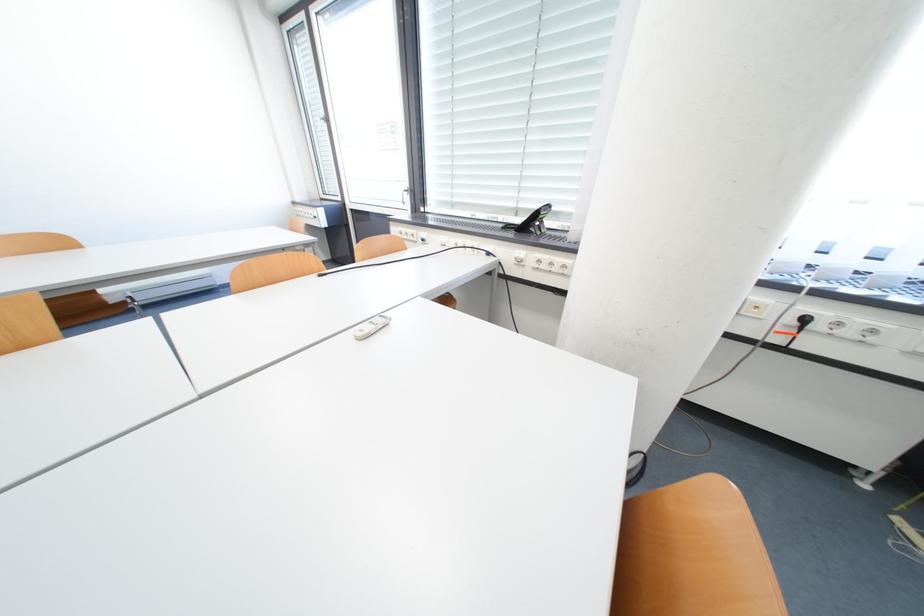
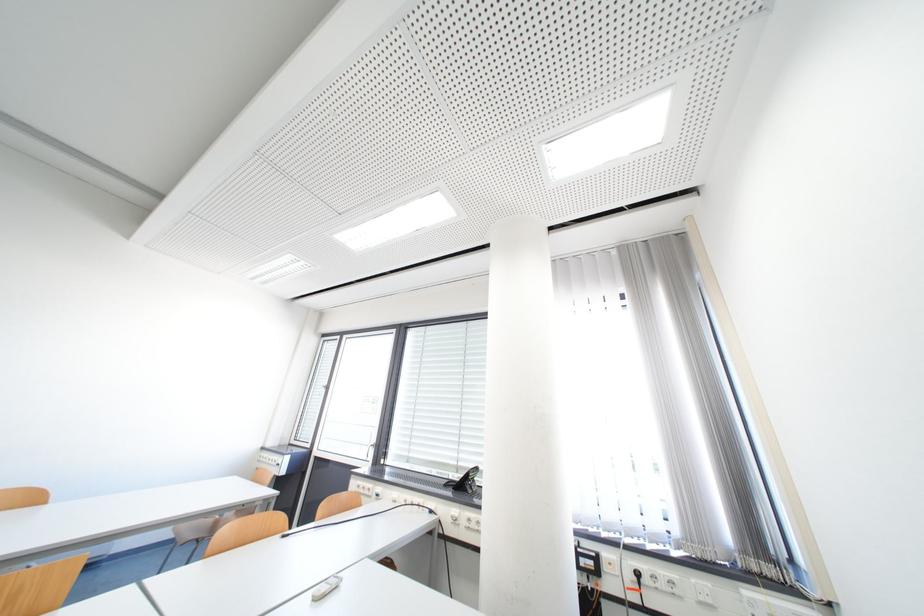
Locate, in the second image, the point that corresponds to point (816, 322) in the first image.

(649, 576)